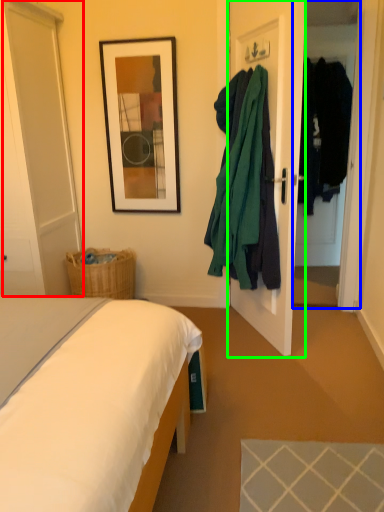
Question: Which is nearer to the glass door (highlighted by a red box)? glass door (highlighted by a blue box) or door (highlighted by a green box).

Choices:
 (A) glass door
 (B) door

Answer: (B)